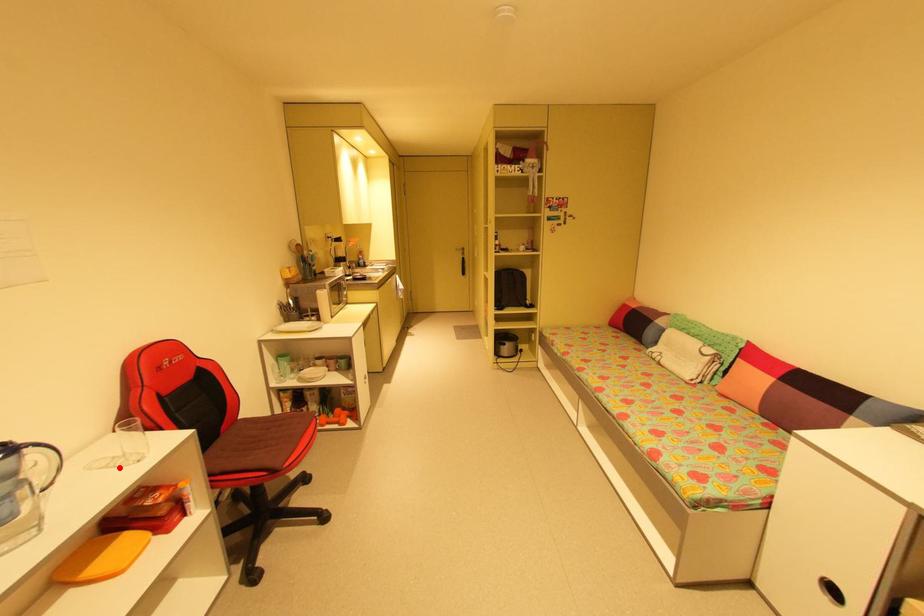
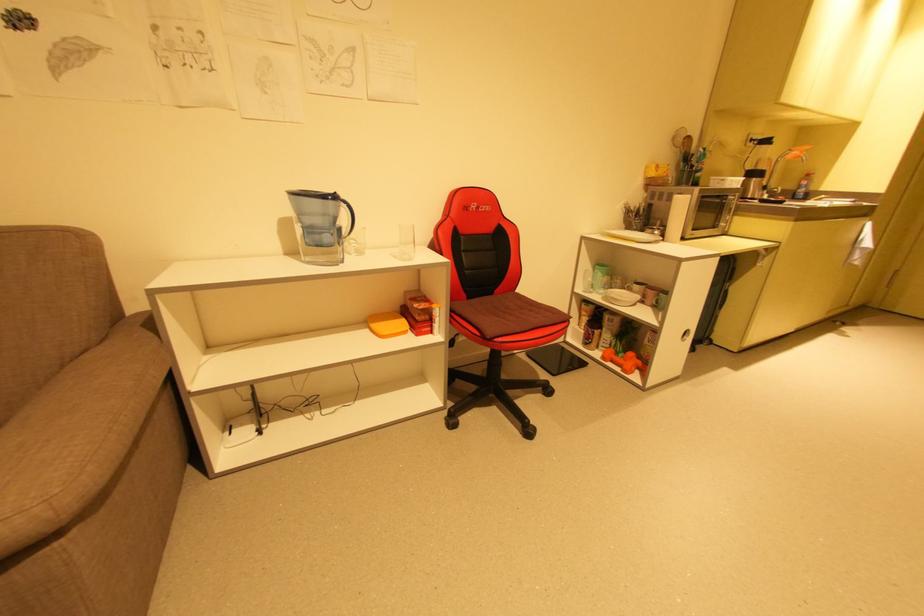
The point at the highlighted location is marked in the first image. Where is the corresponding point in the second image?

(400, 257)